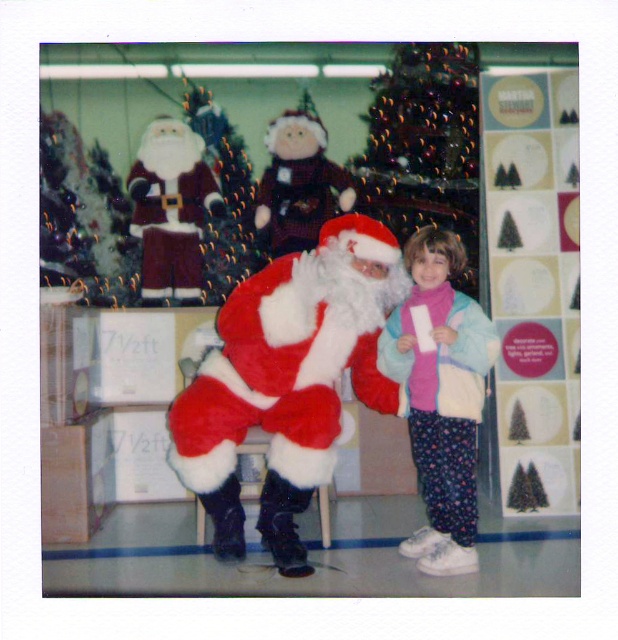
Is fluffy pink sweater at center above shiny green christmas tree at upper center?

Actually, fluffy pink sweater at center is below shiny green christmas tree at upper center.

Does fluffy pink sweater at center have a lesser width compared to shiny green christmas tree at upper center?

Yes, fluffy pink sweater at center is thinner than shiny green christmas tree at upper center.

Find the location of a particular element. The width and height of the screenshot is (618, 640). fluffy pink sweater at center is located at coordinates (441, 397).

Does point (112, 240) come in front of point (222, 170)?

Yes, it is.

Who is taller, shiny green christmas tree at upper left or shiny green christmas tree at upper center?

Standing taller between the two is shiny green christmas tree at upper center.

Is point (95, 237) positioned behind point (210, 160)?

No, it is not.

Where is `shiny green christmas tree at upper left`? This screenshot has height=640, width=618. shiny green christmas tree at upper left is located at coordinates (83, 218).

Can you confirm if fuzzy red santa at center is bigger than shiny green christmas tree at upper left?

Indeed, fuzzy red santa at center has a larger size compared to shiny green christmas tree at upper left.

Is point (289, 276) positioned after point (62, 214)?

No, (289, 276) is closer to viewer.

Is point (381, 260) less distant than point (69, 168)?

Yes, it is.

Find the location of a particular element. fuzzy red santa at center is located at coordinates (287, 380).